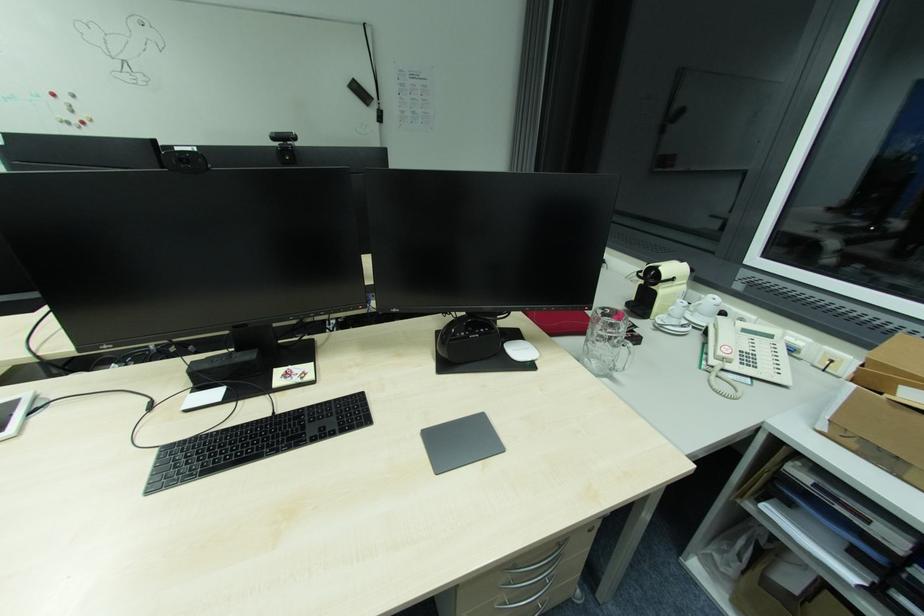
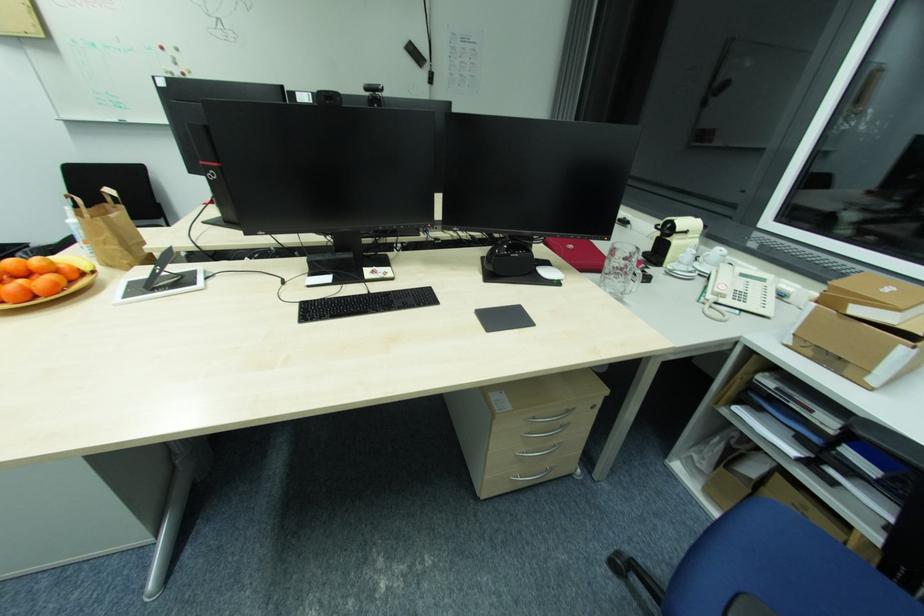
Question: How did the camera likely rotate?

Choices:
 (A) Left
 (B) Right
 (C) Up
 (D) Down

Answer: (D)